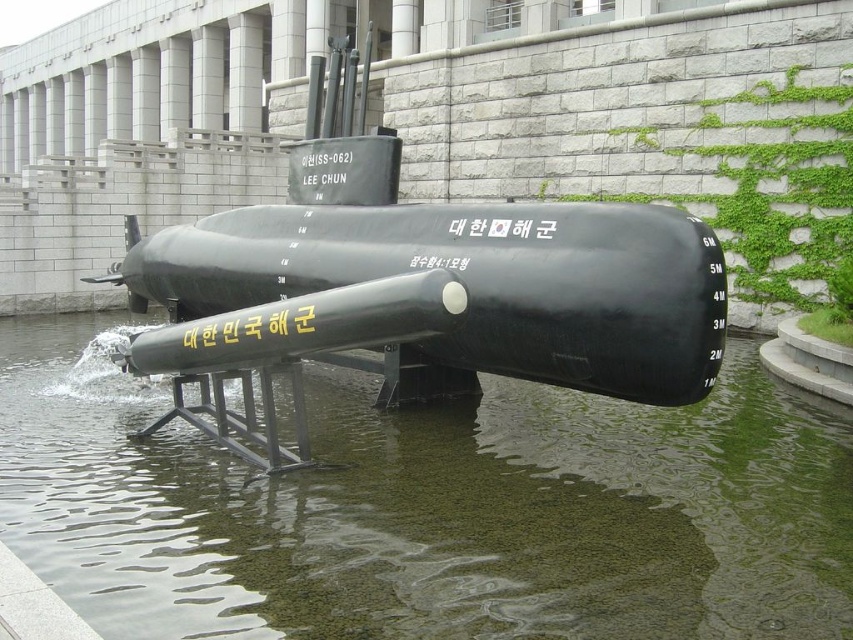
Is point (669, 497) positioned before point (155, 282)?

That is True.

Does transparent water at center have a lesser width compared to black matte submarine at center?

Indeed, transparent water at center has a lesser width compared to black matte submarine at center.

Locate an element on the screen. transparent water at center is located at coordinates 426,508.